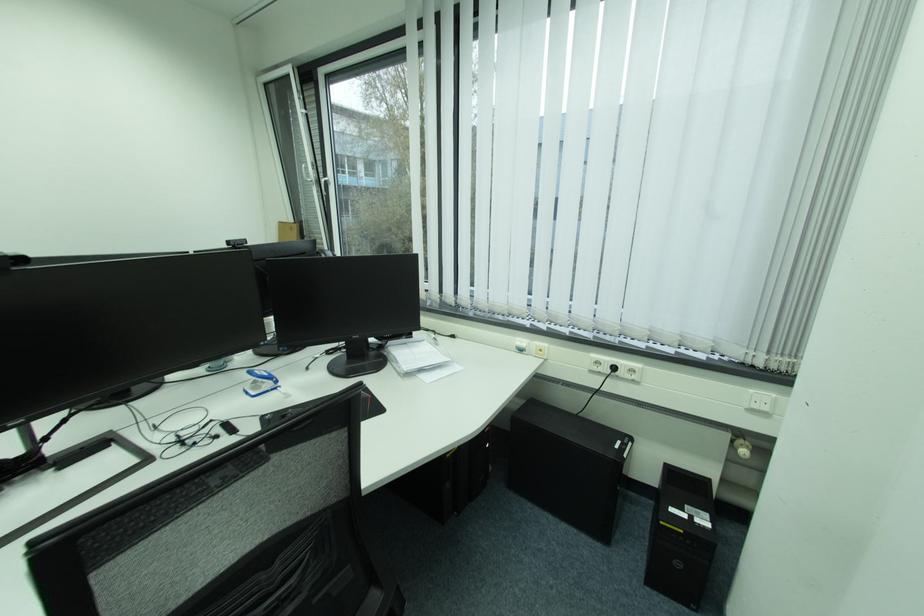
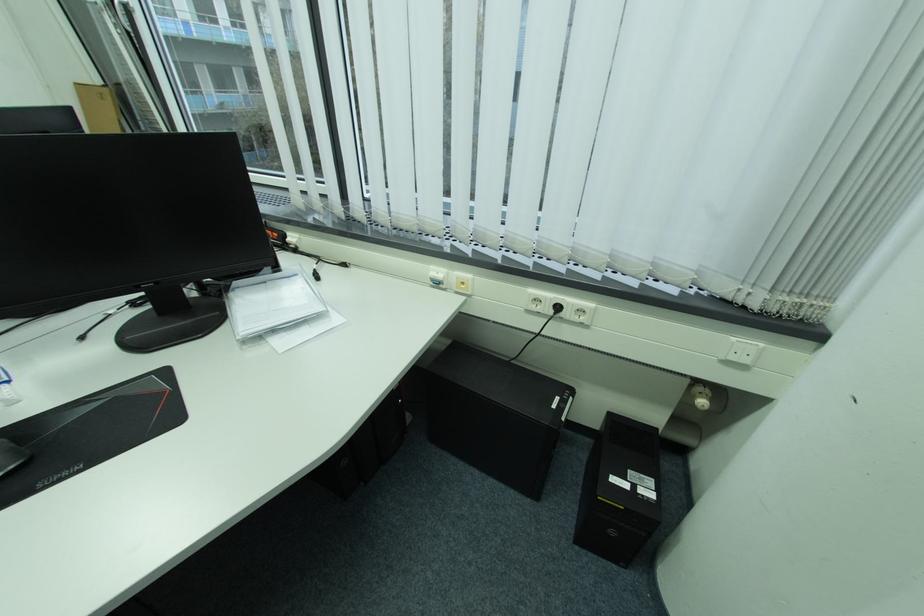
In a continuous first-person perspective shot, in which direction is the camera moving?

The movement direction of the cameraman is right, forward.